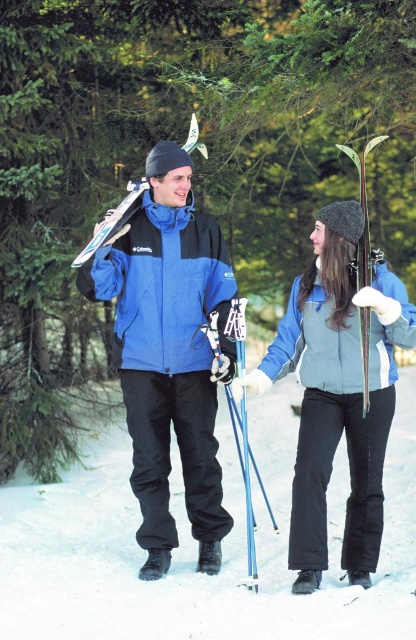
Who is higher up, light blue fleece vest at center or metallic blue ski pole at center?

light blue fleece vest at center is higher up.

Looking at this image, can you confirm if light blue fleece vest at center is positioned to the left of metallic blue ski pole at center?

No, light blue fleece vest at center is not to the left of metallic blue ski pole at center.

Locate an element on the screen. light blue fleece vest at center is located at coordinates (337, 394).

The width and height of the screenshot is (416, 640). Find the location of `light blue fleece vest at center`. light blue fleece vest at center is located at coordinates (337, 394).

Between blue matte ski jacket at center and wooden skis at center, which one has less height?

wooden skis at center is shorter.

Between point (163, 548) and point (364, 160), which one is positioned behind?

Positioned behind is point (163, 548).

The image size is (416, 640). What are the coordinates of `blue matte ski jacket at center` in the screenshot? It's located at (168, 348).

Is blue matte ski jacket at center shorter than blue fabric jacket at center?

Yes, blue matte ski jacket at center is shorter than blue fabric jacket at center.

Is blue matte ski jacket at center positioned before blue fabric jacket at center?

That is True.

Identify the location of blue matte ski jacket at center. The width and height of the screenshot is (416, 640). tap(168, 348).